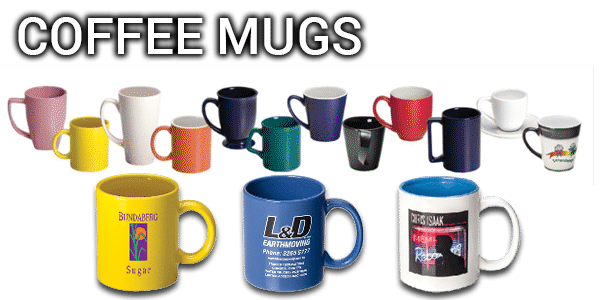
Locate an element on the screen. The height and width of the screenshot is (300, 600). white mug with picture is located at coordinates (552, 142).